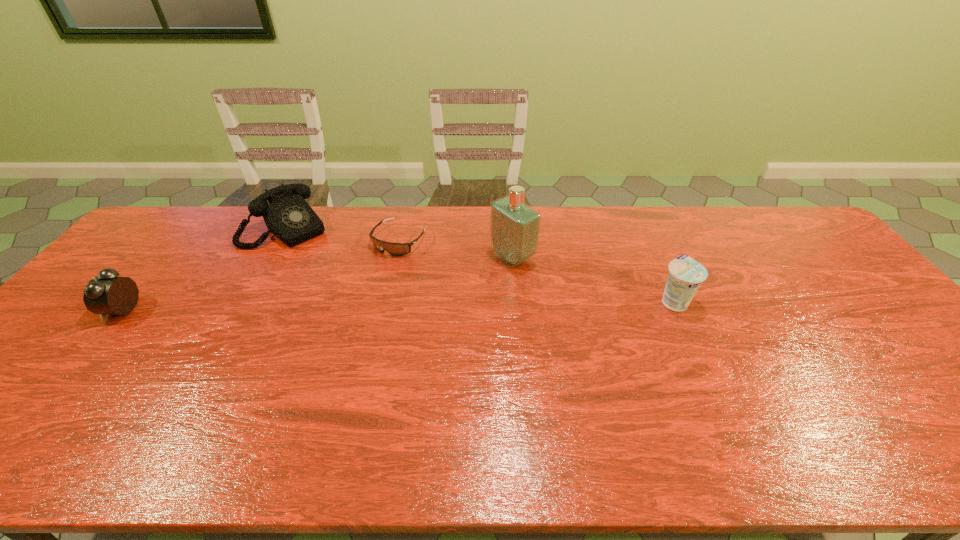
This screenshot has height=540, width=960. I want to click on free space on the desktop that is between the alarm clock and the rightmost object and is positioned on the front label of the second object from right to left, so click(x=423, y=305).

Find the location of a particular element. This screenshot has height=540, width=960. free space on the desktop that is between the alarm clock and the rightmost object and is positioned on the lenses of the goggles is located at coordinates (342, 306).

Identify the location of free space on the desktop that is between the leftmost object and the rightmost object and is positioned on the dial of the fourth object from right to left. The height and width of the screenshot is (540, 960). (364, 306).